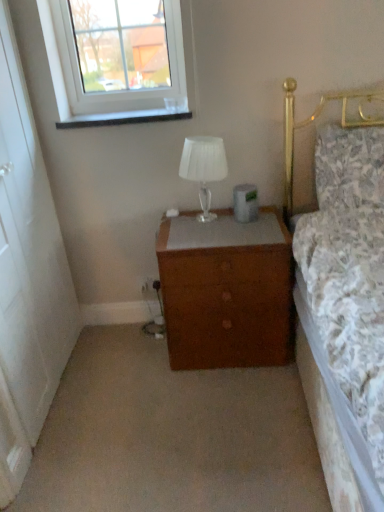
Locate an element on the screen. Image resolution: width=384 pixels, height=512 pixels. vacant space in front of translucent glass lamp at center is located at coordinates (x=202, y=229).